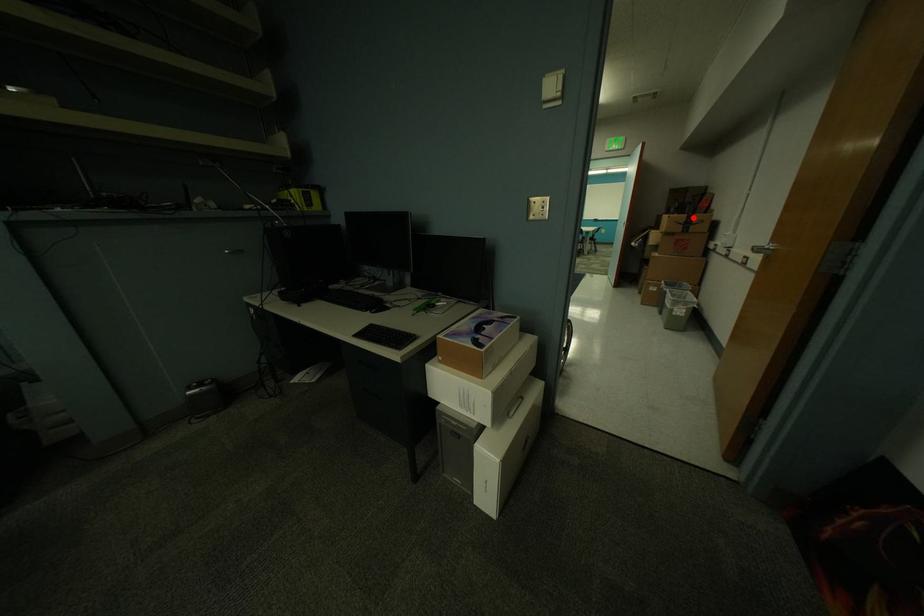
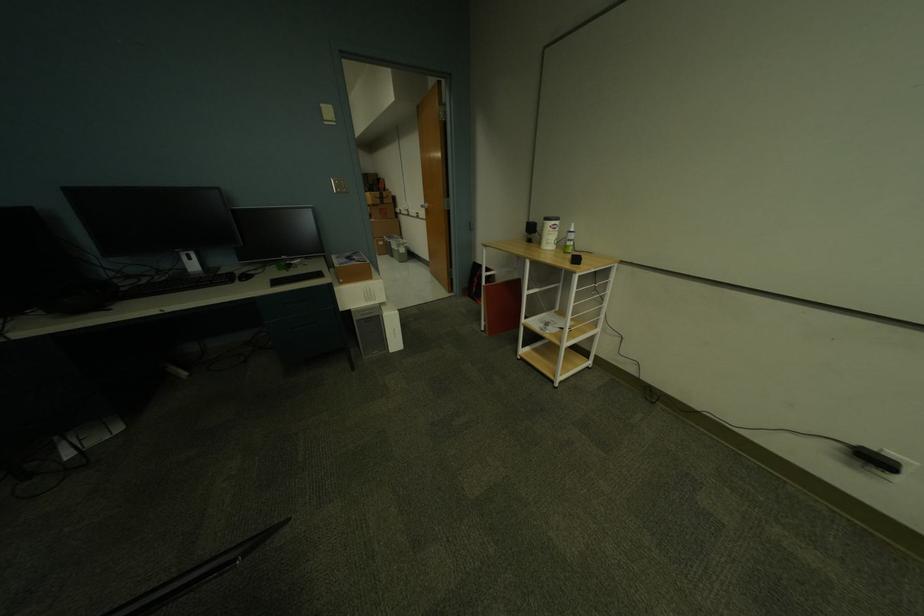
In the second image, find the point that corresponds to the highlighted location in the first image.

(386, 195)